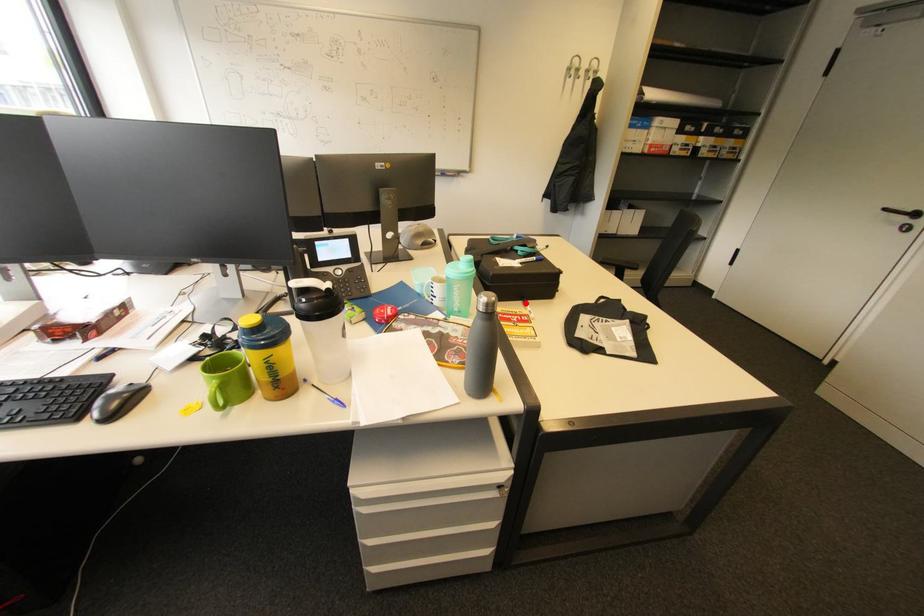
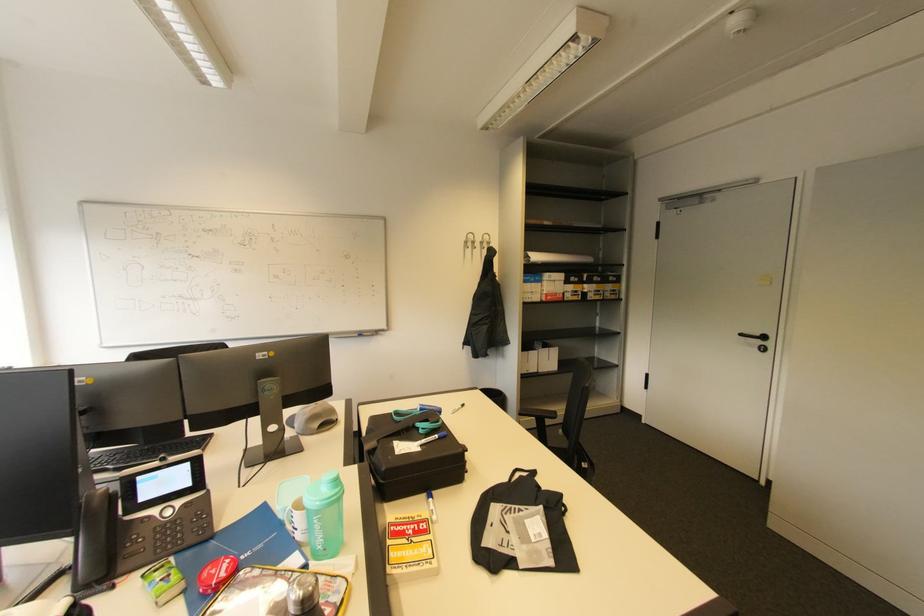
In the second image, find the point that corresponds to the highlighted location in the first image.

(429, 496)